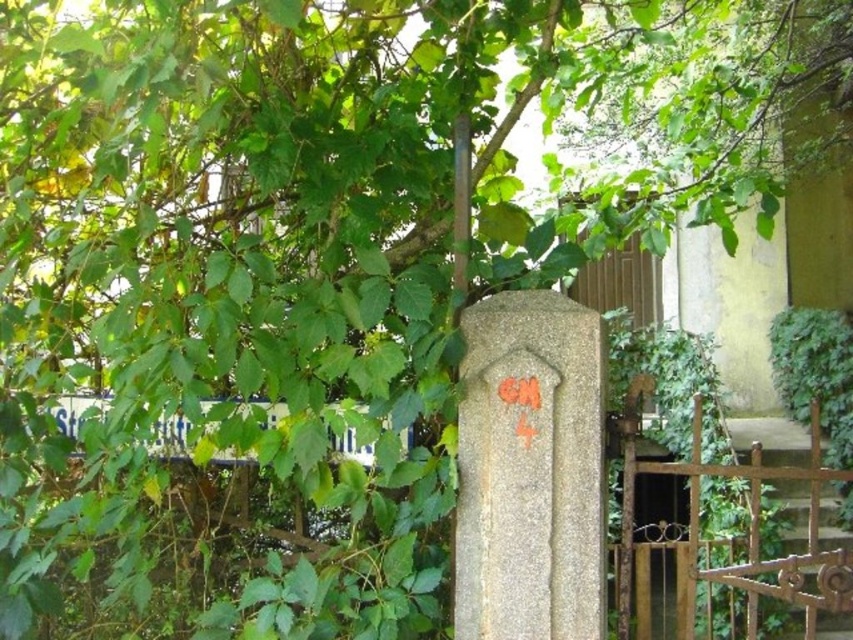
Question: Is granite gravestone at center further to the viewer compared to white plastic street sign at lower left?

Choices:
 (A) yes
 (B) no

Answer: (B)

Question: Which point is closer to the camera taking this photo?

Choices:
 (A) (68, 412)
 (B) (570, 413)

Answer: (B)

Question: Is granite gravestone at center thinner than white plastic street sign at lower left?

Choices:
 (A) no
 (B) yes

Answer: (B)

Question: Is granite gravestone at center positioned before white plastic street sign at lower left?

Choices:
 (A) no
 (B) yes

Answer: (B)

Question: Which object is closer to the camera taking this photo?

Choices:
 (A) white plastic street sign at lower left
 (B) granite gravestone at center

Answer: (B)